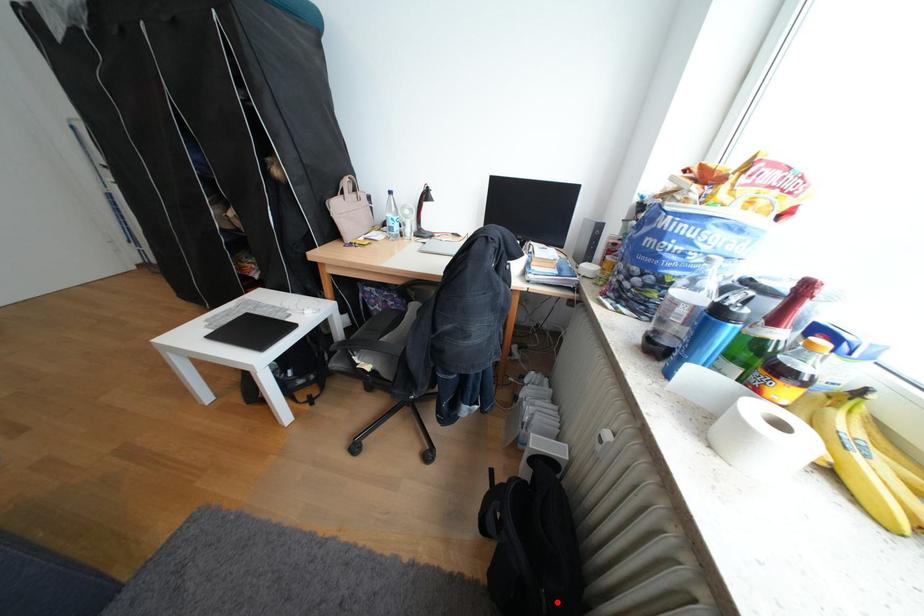
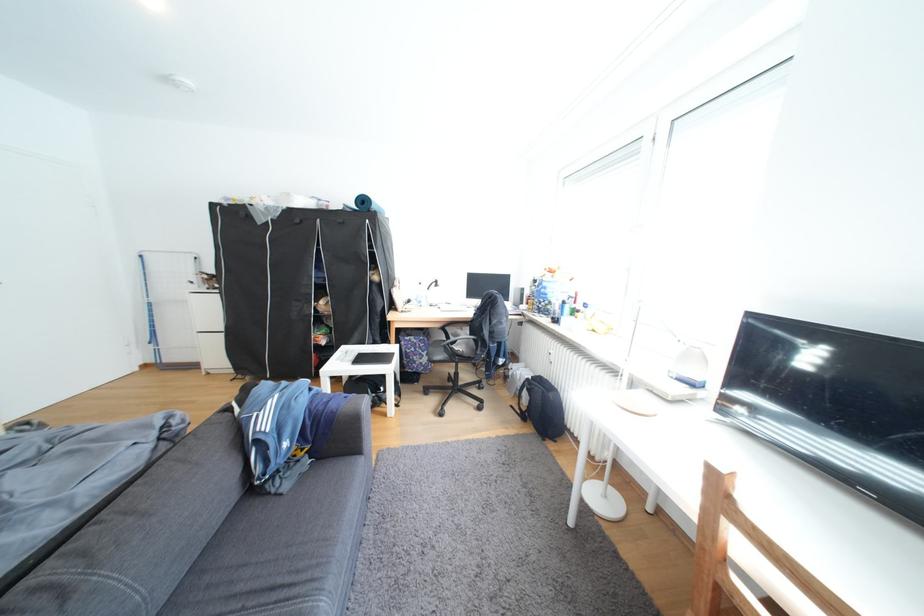
Find the pixel in the second image that matches the highlighted location in the first image.

(564, 398)